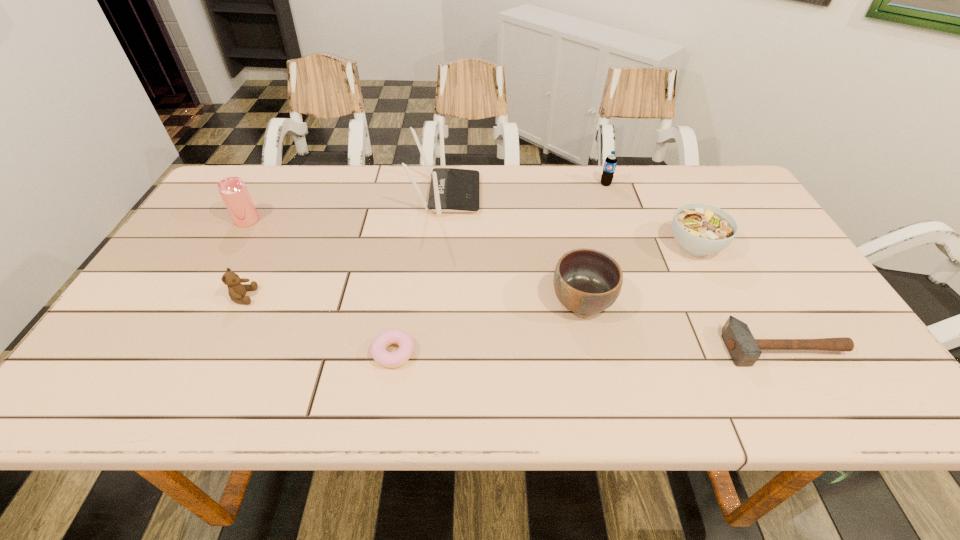
The height and width of the screenshot is (540, 960). Find the location of `soup bowl that is positioned at the right edge`. soup bowl that is positioned at the right edge is located at coordinates (700, 229).

Where is `hammer that is at the right edge`? hammer that is at the right edge is located at coordinates (744, 350).

Locate an element on the screen. This screenshot has width=960, height=540. free space at the far edge is located at coordinates (501, 206).

Find the location of a particular element. The height and width of the screenshot is (540, 960). vacant position at the near edge of the desktop is located at coordinates (298, 390).

In the image, there is a desktop. Where is `vacant space at the right edge`? vacant space at the right edge is located at coordinates pos(801,334).

Image resolution: width=960 pixels, height=540 pixels. In order to click on blank space at the far left corner of the desktop in this screenshot , I will do `click(219, 195)`.

I want to click on vacant space at the near left corner of the desktop, so point(119,379).

This screenshot has width=960, height=540. Find the location of `vacant region at the far right corner of the desktop`. vacant region at the far right corner of the desktop is located at coordinates (726, 180).

The height and width of the screenshot is (540, 960). In order to click on free space between the router and the bowl in this screenshot , I will do `click(515, 248)`.

Find the location of a particular element. free space between the leftmost object and the soup bowl is located at coordinates (471, 233).